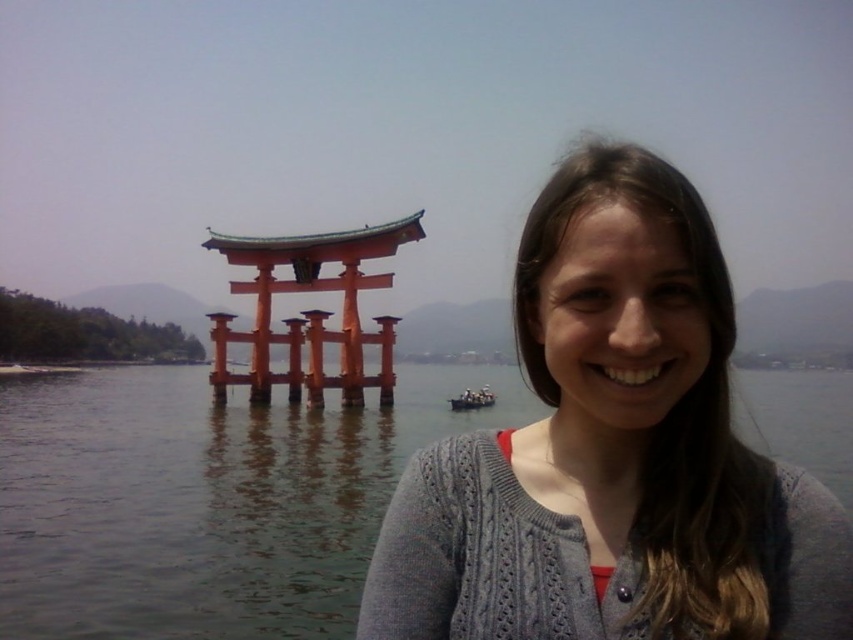
You are a fashion designer trying to create a new line of outfits. You want to ensure that the fabric of your new sweater will not be too tight. Given that the gray knitted sweater at center is worn by a person of average build, can you determine if the sweater is loose enough based on its thickness compared to the transparent water at center?

The gray knitted sweater at center is thinner than the transparent water at center, which suggests that the sweater has a lighter fabric. However, the thickness comparison with water is not a standard measurement for clothing. To determine if the sweater is loose enough, you should consider the fit on the person wearing it rather than the thickness comparison with water.

You are a photographer trying to capture the scene with the gray knitted sweater at center and the wooden boat at center. Which object should you adjust your camera to focus on first if you want to include both in your shot without moving the camera?

You should focus on the gray knitted sweater at center first since it is positioned to the right of the wooden boat at center, allowing both to be captured in the frame by centering the camera between them.

You are a photographer planning to take a photo of the wooden boat at center and the transparent water at center. Based on their positions, which one would appear larger in the photo?

The transparent water at center appears larger in the photo because it is much taller than the wooden boat at center.